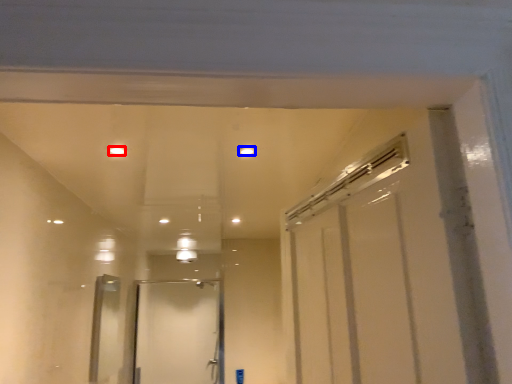
Question: Which point is further to the camera, light (highlighted by a red box) or light (highlighted by a blue box)?

Choices:
 (A) light
 (B) light

Answer: (B)